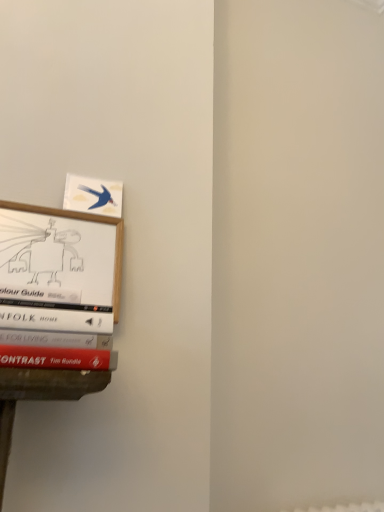
The image size is (384, 512). What do you see at coordinates (93, 195) in the screenshot? I see `matte blue bird at upper left` at bounding box center [93, 195].

At what (x,y) coordinates should I click in order to perform the action: click on matte blue bird at upper left. Please return your answer as a coordinate pair (x, y). Looking at the image, I should click on (93, 195).

Identify the location of wooden picture frame at left. The height and width of the screenshot is (512, 384). [x=89, y=221].

This screenshot has height=512, width=384. Describe the element at coordinates (89, 221) in the screenshot. I see `wooden picture frame at left` at that location.

Identify the location of matte blue bird at upper left. (93, 195).

Considering the relative positions of wooden picture frame at left and matte blue bird at upper left in the image provided, is wooden picture frame at left to the right of matte blue bird at upper left from the viewer's perspective?

Incorrect, wooden picture frame at left is not on the right side of matte blue bird at upper left.

Does wooden picture frame at left lie behind matte blue bird at upper left?

No, it is not.

Which point is more distant from viewer, [116,241] or [86,198]?

The point [86,198] is farther from the camera.

Consider the image. From the image's perspective, who appears lower, wooden picture frame at left or matte blue bird at upper left?

wooden picture frame at left, from the image's perspective.

From a real-world perspective, which is physically above, wooden picture frame at left or matte blue bird at upper left?

matte blue bird at upper left is physically above.

Based on the photo, is wooden picture frame at left wider than matte blue bird at upper left?

Correct, the width of wooden picture frame at left exceeds that of matte blue bird at upper left.

Can you confirm if wooden picture frame at left is taller than matte blue bird at upper left?

Yes.

Considering the sizes of objects wooden picture frame at left and matte blue bird at upper left in the image provided, who is bigger, wooden picture frame at left or matte blue bird at upper left?

Bigger between the two is wooden picture frame at left.

Do you think wooden picture frame at left is within matte blue bird at upper left, or outside of it?

Result: wooden picture frame at left cannot be found inside matte blue bird at upper left.

Is wooden picture frame at left not close to matte blue bird at upper left?

No, there isn't a large distance between wooden picture frame at left and matte blue bird at upper left.

Is matte blue bird at upper left at the back of wooden picture frame at left?

wooden picture frame at left does not have its back to matte blue bird at upper left.

Based on the photo, measure the distance from wooden picture frame at left to matte blue bird at upper left.

6.25 centimeters.

Find the location of `picture frame below the matte blue bird at upper left (from the image's perspective)`. picture frame below the matte blue bird at upper left (from the image's perspective) is located at coordinates point(89,221).

Is matte blue bird at upper left to the left of wooden picture frame at left from the viewer's perspective?

Incorrect, matte blue bird at upper left is not on the left side of wooden picture frame at left.

Is matte blue bird at upper left closer to the viewer compared to wooden picture frame at left?

No.

Does point (81, 209) lie behind point (121, 256)?

No.

From the image's perspective, which one is positioned higher, matte blue bird at upper left or wooden picture frame at left?

matte blue bird at upper left is shown above in the image.

From a real-world perspective, is matte blue bird at upper left on top of wooden picture frame at left?

Yes, from a real-world perspective, matte blue bird at upper left is over wooden picture frame at left

Looking at their sizes, would you say matte blue bird at upper left is wider or thinner than wooden picture frame at left?

matte blue bird at upper left is thinner than wooden picture frame at left.

Which of these two, matte blue bird at upper left or wooden picture frame at left, stands shorter?

matte blue bird at upper left is shorter.

Considering the relative sizes of matte blue bird at upper left and wooden picture frame at left in the image provided, is matte blue bird at upper left bigger than wooden picture frame at left?

No.

Which is correct: matte blue bird at upper left is inside wooden picture frame at left, or outside of it?

matte blue bird at upper left is not enclosed by wooden picture frame at left.

Is matte blue bird at upper left not near wooden picture frame at left?

matte blue bird at upper left is near wooden picture frame at left, not far away.

From the picture: Is matte blue bird at upper left oriented away from wooden picture frame at left?

No, wooden picture frame at left is not at the back of matte blue bird at upper left.

Where is `book that appears on the right of wooden picture frame at left`? book that appears on the right of wooden picture frame at left is located at coordinates (93, 195).

Locate an element on the screen. This screenshot has width=384, height=512. book positioned vertically above the wooden picture frame at left (from a real-world perspective) is located at coordinates (93, 195).

Identify the location of book behind the wooden picture frame at left. (93, 195).